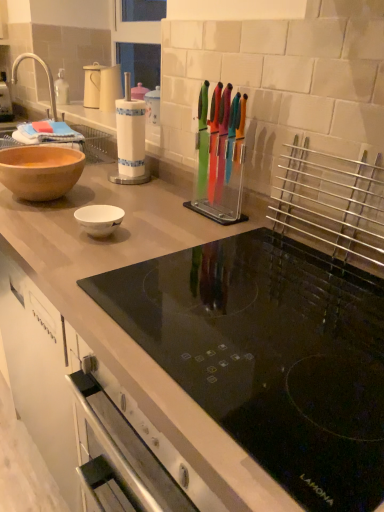
Question: Is white paper towel holder at center, which is counted as the 2th appliance, starting from the right, thinner than matte brown bowl at left?

Choices:
 (A) no
 (B) yes

Answer: (B)

Question: Considering the relative sizes of white paper towel holder at center, the first appliance positioned from the left, and matte brown bowl at left in the image provided, is white paper towel holder at center, the first appliance positioned from the left, taller than matte brown bowl at left?

Choices:
 (A) yes
 (B) no

Answer: (A)

Question: From a real-world perspective, is white paper towel holder at center, the first appliance positioned from the left, positioned under matte brown bowl at left based on gravity?

Choices:
 (A) yes
 (B) no

Answer: (B)

Question: Is white paper towel holder at center, the first appliance positioned from the left, further to camera compared to matte brown bowl at left?

Choices:
 (A) yes
 (B) no

Answer: (A)

Question: Is white paper towel holder at center, the first appliance positioned from the left, smaller than matte brown bowl at left?

Choices:
 (A) yes
 (B) no

Answer: (A)

Question: Would you consider white paper towel holder at center, the first appliance positioned from the left, to be distant from matte brown bowl at left?

Choices:
 (A) yes
 (B) no

Answer: (B)

Question: Is transparent plastic knife block at center, which ranks as the 1th appliance in front-to-back order, looking in the opposite direction of white paper towel holder at center, the 1th appliance in the back-to-front sequence?

Choices:
 (A) no
 (B) yes

Answer: (A)

Question: Is transparent plastic knife block at center, arranged as the 2th appliance when viewed from the back, to the left of white paper towel holder at center, which is counted as the second appliance, starting from the front, from the viewer's perspective?

Choices:
 (A) yes
 (B) no

Answer: (B)

Question: Considering the relative positions of transparent plastic knife block at center, arranged as the 2th appliance when viewed from the back, and white paper towel holder at center, which is counted as the second appliance, starting from the front, in the image provided, is transparent plastic knife block at center, arranged as the 2th appliance when viewed from the back, in front of white paper towel holder at center, which is counted as the second appliance, starting from the front,?

Choices:
 (A) yes
 (B) no

Answer: (A)

Question: From the image's perspective, does transparent plastic knife block at center, marked as the 2th appliance in a left-to-right arrangement, appear higher than white paper towel holder at center, which is counted as the second appliance, starting from the front?

Choices:
 (A) no
 (B) yes

Answer: (A)

Question: Considering the relative sizes of transparent plastic knife block at center, which ranks as the 1th appliance in front-to-back order, and white paper towel holder at center, which is counted as the 2th appliance, starting from the right, in the image provided, is transparent plastic knife block at center, which ranks as the 1th appliance in front-to-back order, smaller than white paper towel holder at center, which is counted as the 2th appliance, starting from the right,?

Choices:
 (A) no
 (B) yes

Answer: (B)

Question: Is transparent plastic knife block at center, arranged as the 2th appliance when viewed from the back, far from white paper towel holder at center, which is counted as the 2th appliance, starting from the right?

Choices:
 (A) no
 (B) yes

Answer: (A)

Question: Can you confirm if transparent plastic knife block at center, placed as the 1th appliance when sorted from right to left, is taller than matte white container at upper left?

Choices:
 (A) no
 (B) yes

Answer: (B)